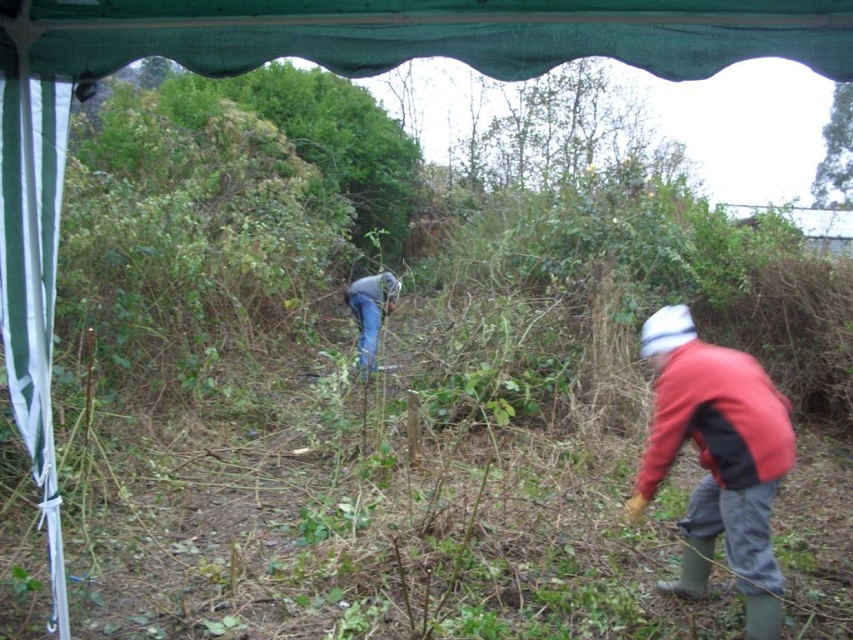
You are standing at the edge of the garden and need to pass between the red matte jacket at lower right and the denim jeans at center to reach the tool shed. The path between them is 1.2 meters wide. Can your 1.5 meter wide equipment pass through?

The path between the red matte jacket at lower right and the denim jeans at center is 1.2 meters wide, which is narrower than your 1.5 meter wide equipment. Therefore, the equipment cannot pass through this path.

You are a hiker who wants to locate the red matte jacket at lower right and the denim jeans at center in the scene. Based on the description, which object is positioned farther to the east?

The red matte jacket at lower right is to the right of denim jeans at center, so if the scene is oriented with right as east, the red matte jacket at lower right would be farther east.